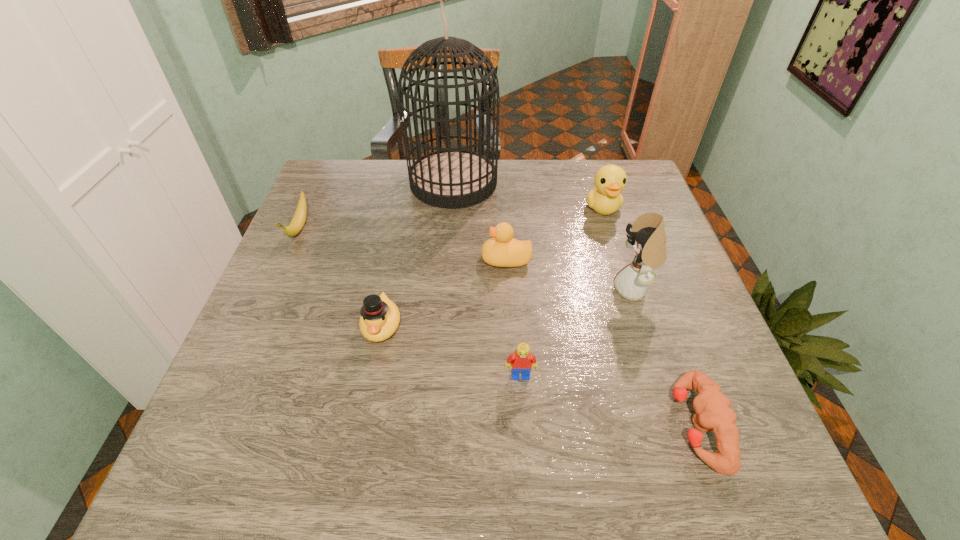
At what (x,y) coordinates should I click in order to perform the action: click on free region located 0.180m at the front face of the second tallest object. Please return your answer as a coordinate pair (x, y). The height and width of the screenshot is (540, 960). Looking at the image, I should click on (534, 289).

Where is `vacant region located 0.390m at the front face of the second tallest object`? vacant region located 0.390m at the front face of the second tallest object is located at coordinates (441, 289).

At what (x,y) coordinates should I click in order to perform the action: click on blank space located 0.300m at the front face of the second tallest object. Please return your answer as a coordinate pair (x, y). The width and height of the screenshot is (960, 540). Looking at the image, I should click on pos(481,289).

Where is `vacant space positioned 0.250m on the face of the farthest duck`? This screenshot has height=540, width=960. vacant space positioned 0.250m on the face of the farthest duck is located at coordinates click(630, 293).

What are the coordinates of `free location located on the face of the second duck from left to right` in the screenshot? It's located at (370, 259).

This screenshot has height=540, width=960. Identify the location of blank space located on the face of the second duck from left to right. (398, 259).

In order to click on vacant region located on the face of the second duck from left to right in this screenshot , I will do `click(398, 259)`.

Locate an element on the screen. free space located 0.260m on the front-facing side of the nearest duck is located at coordinates (350, 487).

Locate an element on the screen. This screenshot has height=540, width=960. vacant area situated on the face of the Lego is located at coordinates (525, 437).

This screenshot has width=960, height=540. In order to click on vacant space situated 0.370m at the stem of the leftmost object in this screenshot , I will do `click(229, 386)`.